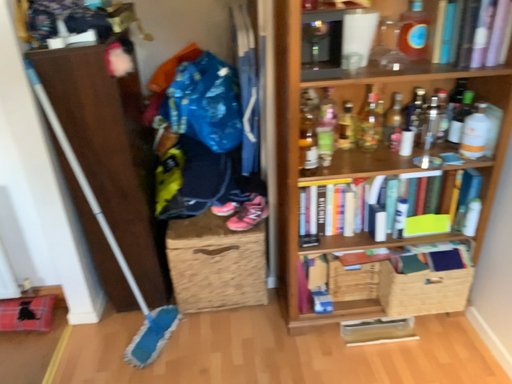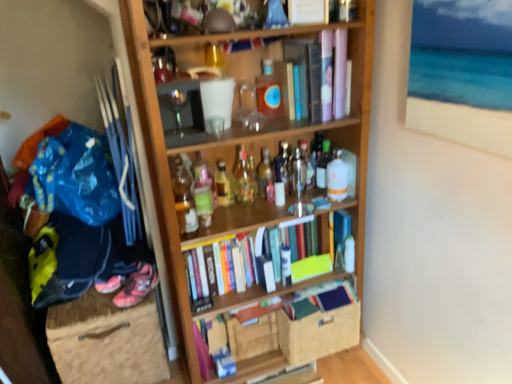
Question: Which way did the camera rotate in the video?

Choices:
 (A) rotated downward
 (B) rotated upward

Answer: (B)